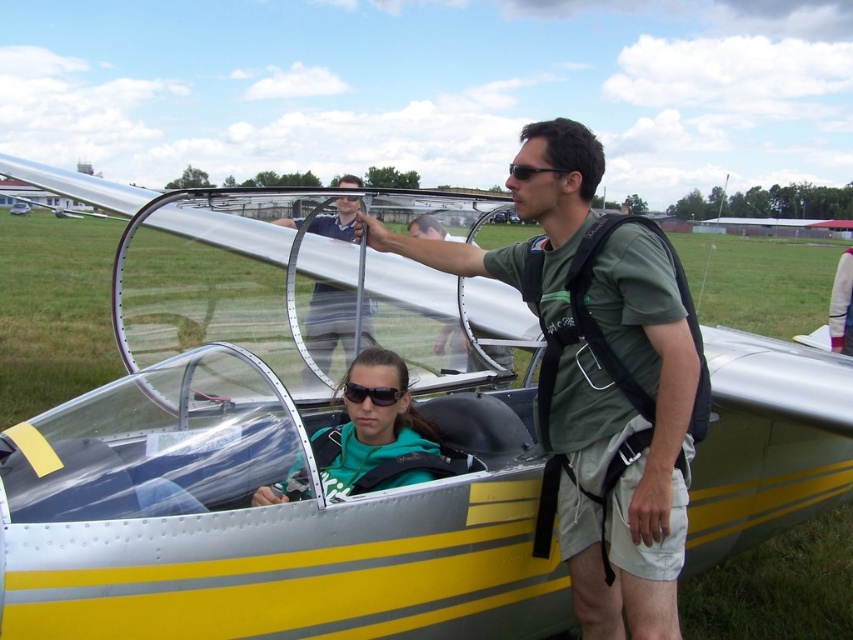
Question: Which of these objects is positioned closest to the green fabric seat at center?

Choices:
 (A) black matte sunglasses at center
 (B) matte black helmet at center
 (C) black plastic sunglasses at center
 (D) green fabric shirt at center

Answer: (C)

Question: Which object is the farthest from the matte black helmet at center?

Choices:
 (A) black matte sunglasses at center
 (B) green fabric seat at center
 (C) black plastic sunglasses at center
 (D) green fabric shirt at center

Answer: (A)

Question: Is matte black helmet at center to the right of black matte sunglasses at center from the viewer's perspective?

Choices:
 (A) no
 (B) yes

Answer: (A)

Question: Can you confirm if green fabric shirt at center is positioned above green fabric seat at center?

Choices:
 (A) no
 (B) yes

Answer: (B)

Question: Is black plastic sunglasses at center above black matte sunglasses at center?

Choices:
 (A) yes
 (B) no

Answer: (B)

Question: Which object is closer to the camera taking this photo?

Choices:
 (A) green fabric shirt at center
 (B) black plastic sunglasses at center
 (C) matte black helmet at center

Answer: (A)